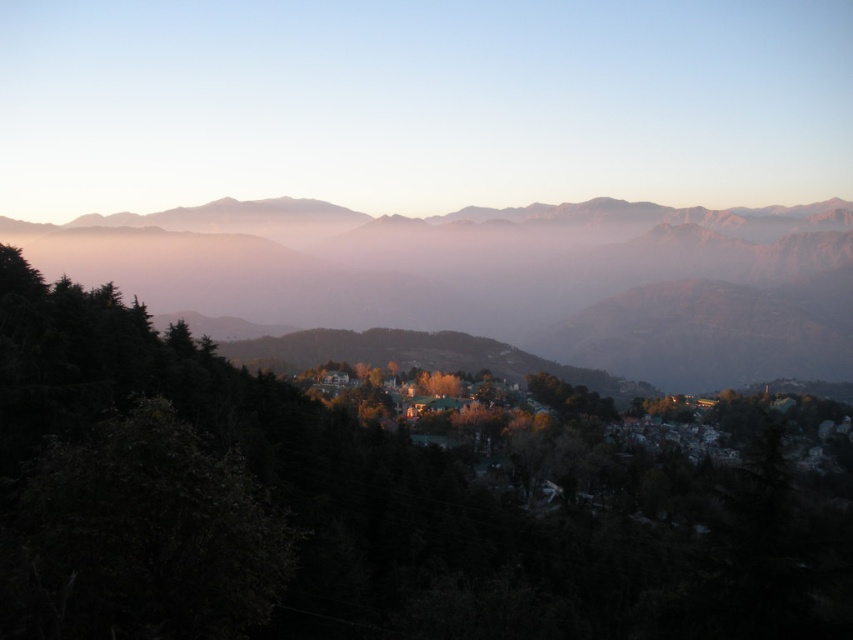
Question: Where is green matte tree at center located in relation to pastel pink mountains at upper center in the image?

Choices:
 (A) below
 (B) above

Answer: (A)

Question: Can you confirm if pastel pink mountains at upper center is positioned to the right of gray rocky mountain range at center?

Choices:
 (A) no
 (B) yes

Answer: (B)

Question: Is green matte tree at center wider than gray rocky mountain range at center?

Choices:
 (A) yes
 (B) no

Answer: (B)

Question: Which point is farther from the camera taking this photo?

Choices:
 (A) (460, 52)
 (B) (578, 298)
 (C) (830, 634)

Answer: (A)

Question: Which point is closer to the camera?

Choices:
 (A) gray rocky mountain range at center
 (B) pastel pink mountains at upper center

Answer: (A)

Question: Which object is closer to the camera taking this photo?

Choices:
 (A) gray rocky mountain range at center
 (B) green matte tree at center
 (C) pastel pink mountains at upper center

Answer: (B)